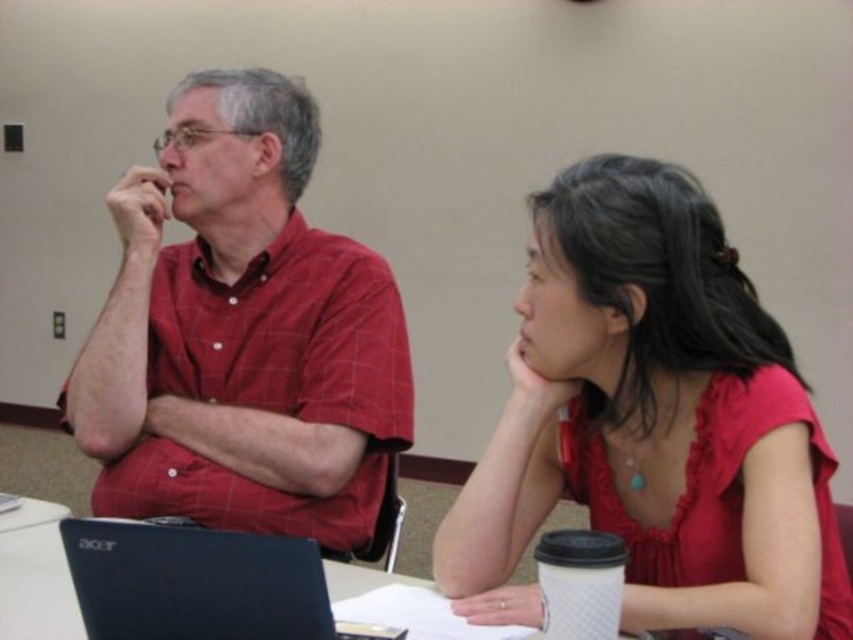
Question: Which object appears farthest from the camera in this image?

Choices:
 (A) black matte laptop at lower left
 (B) white paper at center

Answer: (B)

Question: In this image, where is matte red blouse at center located relative to black matte laptop at lower left?

Choices:
 (A) right
 (B) left

Answer: (A)

Question: Does matte red blouse at center appear over white paper at center?

Choices:
 (A) yes
 (B) no

Answer: (A)

Question: Among these points, which one is nearest to the camera?

Choices:
 (A) (223, 588)
 (B) (817, 490)
 (C) (73, 612)
 (D) (291, 524)

Answer: (A)

Question: Where is matte red shirt at left located in relation to white paper at center in the image?

Choices:
 (A) right
 (B) left

Answer: (A)

Question: Which point is closer to the camera?

Choices:
 (A) matte red blouse at center
 (B) black matte laptop at lower left
 (C) matte red shirt at left

Answer: (B)